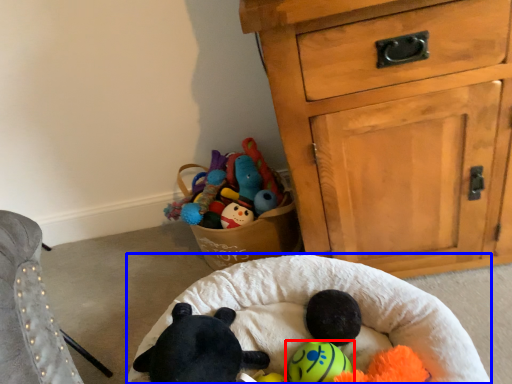
Question: Which of the following is the closest to the observer, toy (highlighted by a red box) or infant bed (highlighted by a blue box)?

Choices:
 (A) toy
 (B) infant bed

Answer: (B)